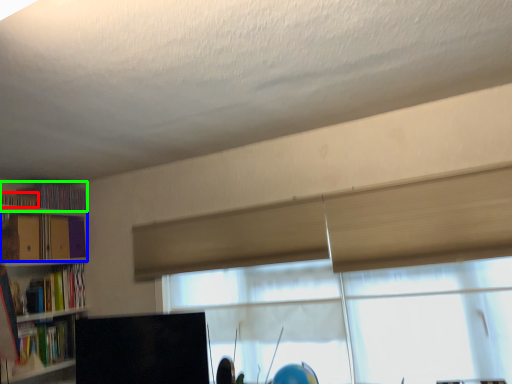
Question: Which object is positioned closest to book (highlighted by a red box)? Select from book (highlighted by a blue box) and book (highlighted by a green box).

Choices:
 (A) book
 (B) book

Answer: (B)